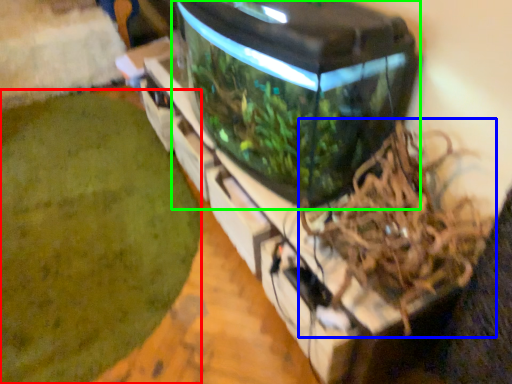
Question: Which object is positioned closest to debris (highlighted by a red box)? Select from bird nest (highlighted by a blue box) and water tank (highlighted by a green box).

Choices:
 (A) bird nest
 (B) water tank

Answer: (B)